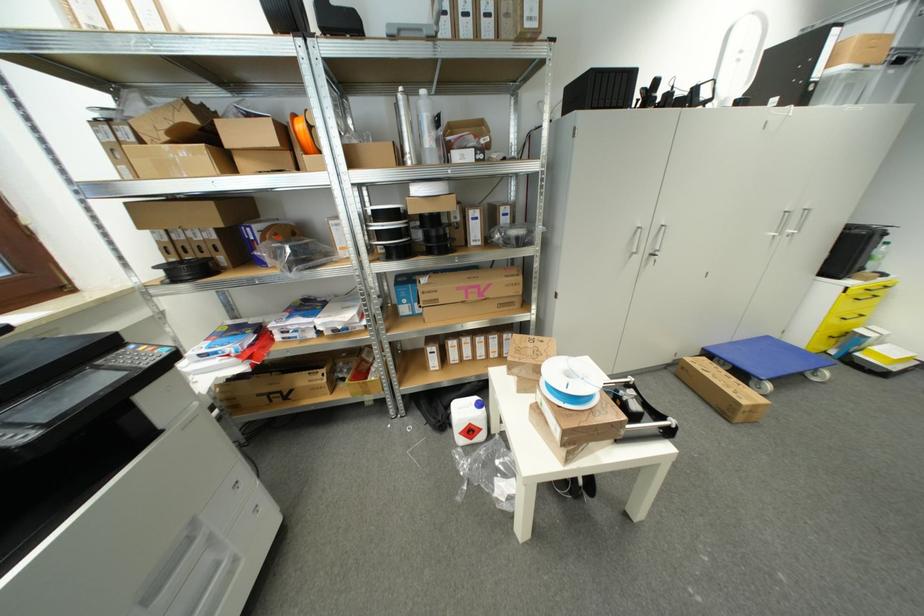
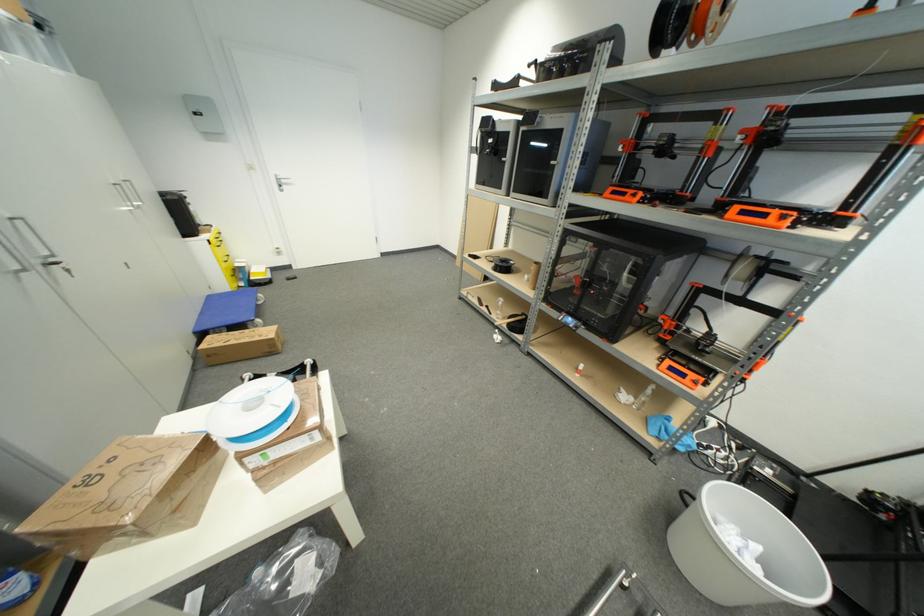
Find the pixel in the second image that matches [772,339] in the first image.

(213, 299)